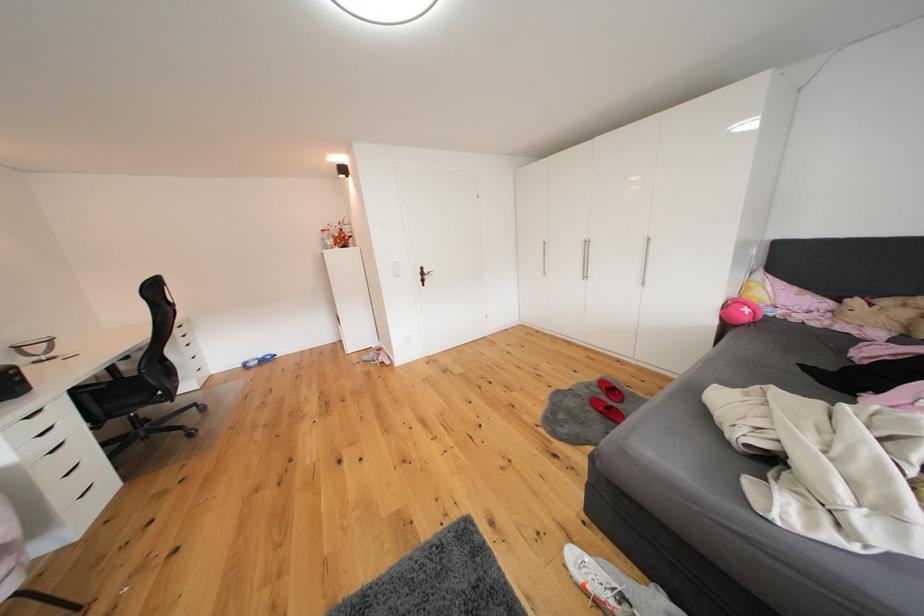
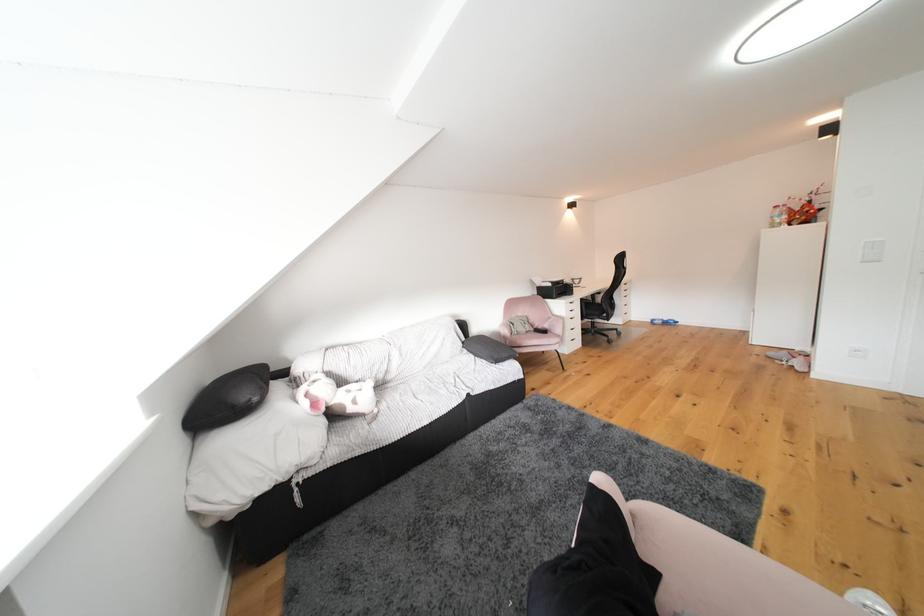
Locate, in the second image, the point that corresponds to pixel 69 382 in the first image.

(590, 297)